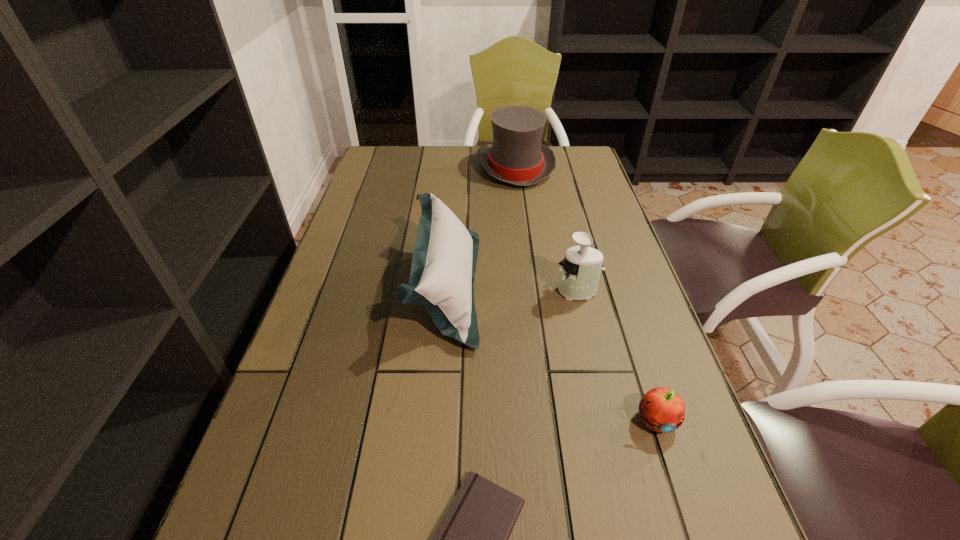
Locate an element on the screen. dress hat at the right edge is located at coordinates (516, 156).

You are a GUI agent. You are given a task and a screenshot of the screen. Output one action in this format:
    pyautogui.click(x=<x>, y=<y>)
    Task: Click on the juicer that is at the right edge
    The height and width of the screenshot is (540, 960).
    Given the screenshot: What is the action you would take?
    [580, 273]

The width and height of the screenshot is (960, 540). Identify the location of apple that is at the right edge. (663, 410).

Find the location of `object positioned at the far right corner`. object positioned at the far right corner is located at coordinates (516, 156).

In order to click on vacant space at the far edge of the desktop in this screenshot , I will do `click(439, 176)`.

Locate an element on the screen. Image resolution: width=960 pixels, height=540 pixels. free region at the left edge of the desktop is located at coordinates (348, 362).

Where is `free location at the right edge of the desktop`? The width and height of the screenshot is (960, 540). free location at the right edge of the desktop is located at coordinates (625, 249).

Locate an element on the screen. This screenshot has height=540, width=960. free space at the far left corner of the desktop is located at coordinates (407, 168).

The height and width of the screenshot is (540, 960). I want to click on vacant space at the far right corner, so click(581, 164).

Locate an element on the screen. Image resolution: width=960 pixels, height=540 pixels. empty space that is in between the cushion and the fourth tallest object is located at coordinates (550, 353).